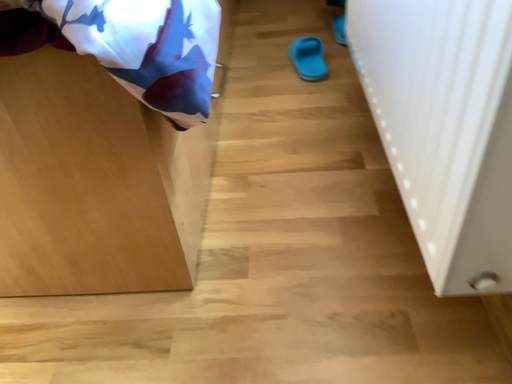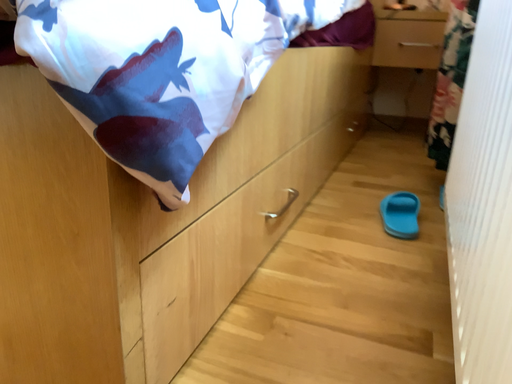
Question: Which way did the camera rotate in the video?

Choices:
 (A) rotated right
 (B) rotated left

Answer: (B)